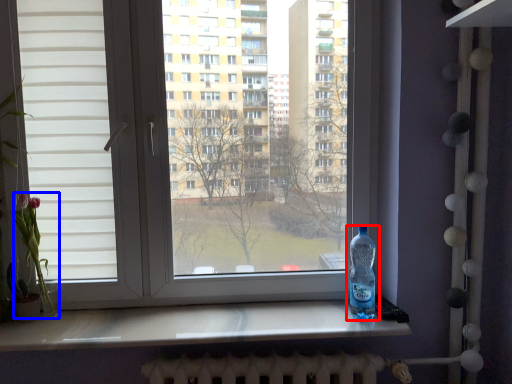
Question: Which object is closer to the camera taking this photo, bottle (highlighted by a red box) or flower (highlighted by a blue box)?

Choices:
 (A) bottle
 (B) flower

Answer: (A)